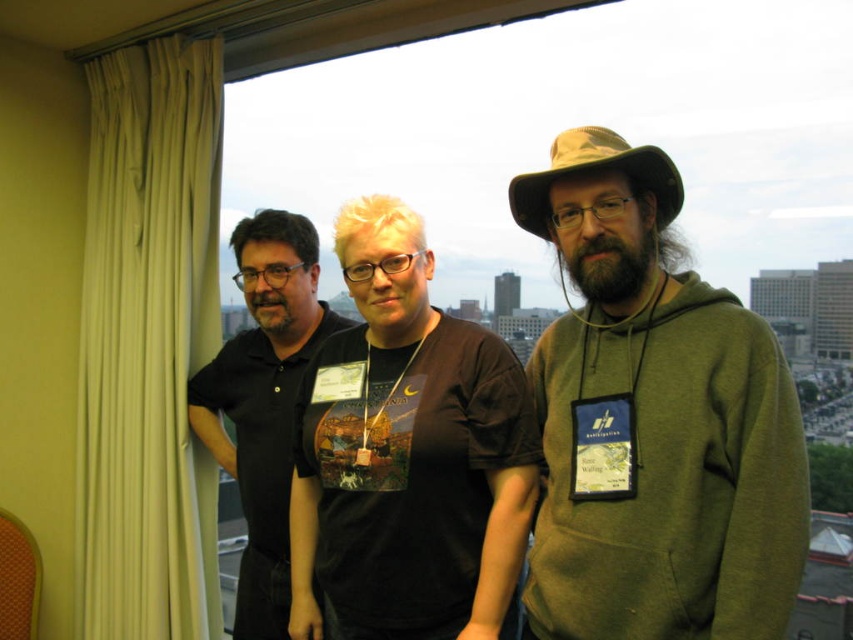
Is point (753, 516) farther from camera compared to point (241, 403)?

No, (753, 516) is closer to viewer.

In the scene shown: Is green matte hoodie at right bigger than black matte shirt at left?

Yes, green matte hoodie at right is bigger than black matte shirt at left.

This screenshot has width=853, height=640. Describe the element at coordinates (654, 422) in the screenshot. I see `green matte hoodie at right` at that location.

At what (x,y) coordinates should I click in order to perform the action: click on green matte hoodie at right. Please return your answer as a coordinate pair (x, y). Looking at the image, I should click on (654, 422).

Does black matte t-shirt at center have a greater height compared to black matte shirt at left?

No, black matte t-shirt at center is not taller than black matte shirt at left.

At what (x,y) coordinates should I click in order to perform the action: click on black matte t-shirt at center. Please return your answer as a coordinate pair (x, y). The height and width of the screenshot is (640, 853). Looking at the image, I should click on (409, 456).

Where is `black matte t-shirt at center`? This screenshot has width=853, height=640. black matte t-shirt at center is located at coordinates (409, 456).

Image resolution: width=853 pixels, height=640 pixels. I want to click on green matte hoodie at right, so click(654, 422).

In the scene shown: Who is taller, green matte hoodie at right or black matte t-shirt at center?

With more height is green matte hoodie at right.

What are the coordinates of `green matte hoodie at right` in the screenshot? It's located at (654, 422).